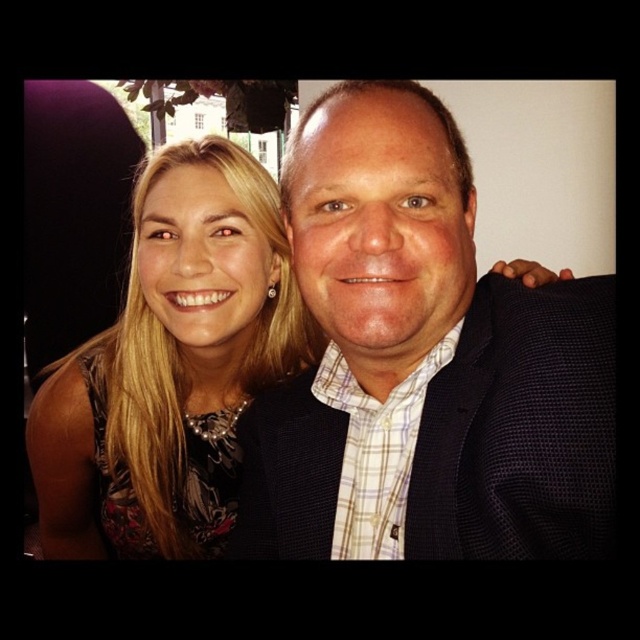
Question: Among these points, which one is farthest from the camera?

Choices:
 (A) (374, 413)
 (B) (161, 188)

Answer: (B)

Question: Where is matte black suit at center located in relation to matte black dress at left in the image?

Choices:
 (A) above
 (B) below

Answer: (A)

Question: Where is matte black suit at center located in relation to matte black dress at left in the image?

Choices:
 (A) below
 (B) above

Answer: (B)

Question: Which object is closer to the camera taking this photo?

Choices:
 (A) matte black dress at left
 (B) matte black suit at center

Answer: (B)

Question: Which point is farther to the camera?

Choices:
 (A) matte black dress at left
 (B) matte black suit at center

Answer: (A)

Question: Does matte black suit at center have a lesser width compared to matte black dress at left?

Choices:
 (A) yes
 (B) no

Answer: (A)